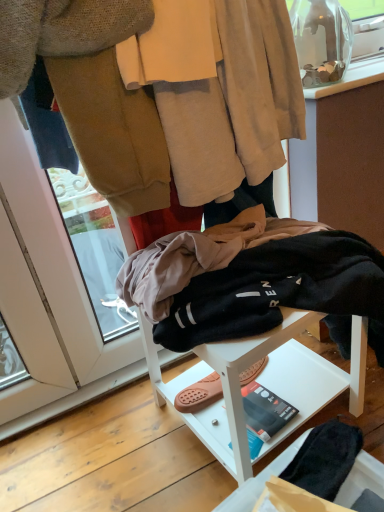
Question: Is beige soft fabric robe at upper center in front of or behind white matte stool at center in the image?

Choices:
 (A) behind
 (B) front

Answer: (A)

Question: Visually, is beige soft fabric robe at upper center positioned to the left or to the right of white matte stool at center?

Choices:
 (A) left
 (B) right

Answer: (A)

Question: Considering the positions of point (203, 72) and point (317, 380), is point (203, 72) closer or farther from the camera than point (317, 380)?

Choices:
 (A) farther
 (B) closer

Answer: (B)

Question: From their relative heights in the image, would you say white matte stool at center is taller or shorter than beige soft fabric robe at upper center?

Choices:
 (A) tall
 (B) short

Answer: (A)

Question: Considering the relative positions of white matte stool at center and beige soft fabric robe at upper center in the image provided, is white matte stool at center to the left or to the right of beige soft fabric robe at upper center?

Choices:
 (A) left
 (B) right

Answer: (B)

Question: Is white matte stool at center spatially inside beige soft fabric robe at upper center, or outside of it?

Choices:
 (A) outside
 (B) inside

Answer: (A)

Question: From the image's perspective, is white matte stool at center located above or below beige soft fabric robe at upper center?

Choices:
 (A) below
 (B) above

Answer: (A)